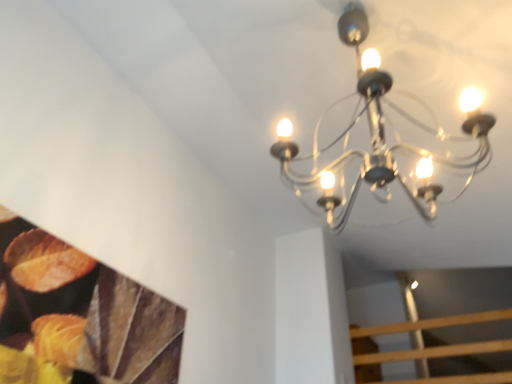
Find the location of a particular element. This screenshot has height=384, width=512. metallic chandelier at upper center is located at coordinates pos(379,139).

Describe the element at coordinates (379, 139) in the screenshot. I see `metallic chandelier at upper center` at that location.

I want to click on metallic chandelier at upper center, so click(379, 139).